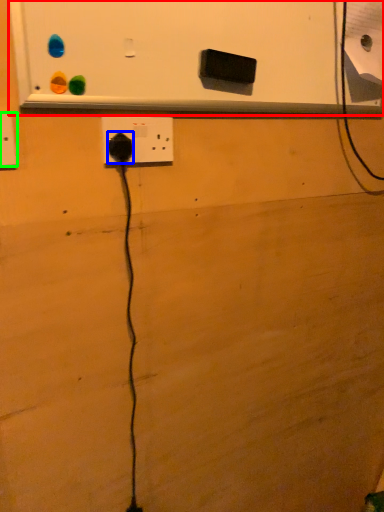
Question: Which object is positioned farthest from bulletin board (highlighted by a red box)? Select from power plugs and sockets (highlighted by a blue box) and power plugs and sockets (highlighted by a green box).

Choices:
 (A) power plugs and sockets
 (B) power plugs and sockets

Answer: (B)